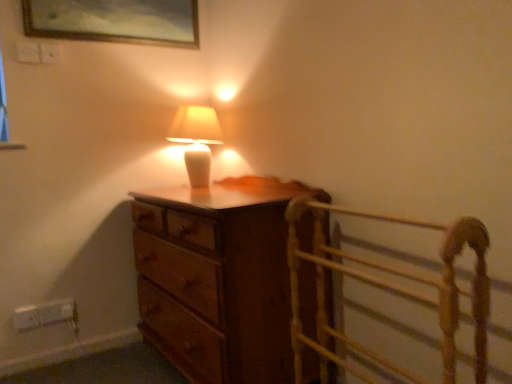
Question: Do you think gold-framed painting at upper center is within wooden bed frame at right, or outside of it?

Choices:
 (A) outside
 (B) inside

Answer: (A)

Question: Is gold-framed painting at upper center taller or shorter than wooden bed frame at right?

Choices:
 (A) short
 (B) tall

Answer: (A)

Question: Which is farther from the white plastic electric outlet at lower left, marked as the second electric outlet in a right-to-left arrangement?

Choices:
 (A) white plastic electric outlet at lower left, arranged as the second electric outlet when viewed from the left
 (B) matte white lamp at center
 (C) gold-framed painting at upper center
 (D) wooden bed frame at right
 (E) wooden chest of drawers at center

Answer: (D)

Question: Which object is positioned closest to the white plastic electric outlet at lower left, the first electric outlet from the left?

Choices:
 (A) wooden bed frame at right
 (B) wooden chest of drawers at center
 (C) gold-framed painting at upper center
 (D) matte white lamp at center
 (E) white plastic electric outlet at lower left, arranged as the second electric outlet when viewed from the left

Answer: (E)